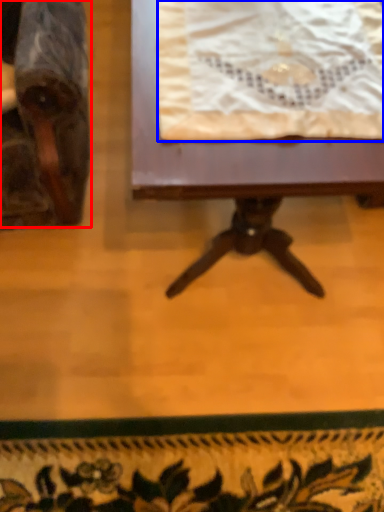
Question: Among these objects, which one is farthest to the camera, chair (highlighted by a red box) or blanket (highlighted by a blue box)?

Choices:
 (A) chair
 (B) blanket

Answer: (B)